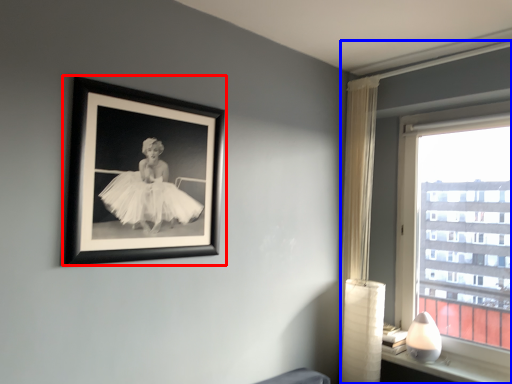
Question: Which of the following is the farthest to the observer, picture frame (highlighted by a red box) or window (highlighted by a blue box)?

Choices:
 (A) picture frame
 (B) window

Answer: (B)